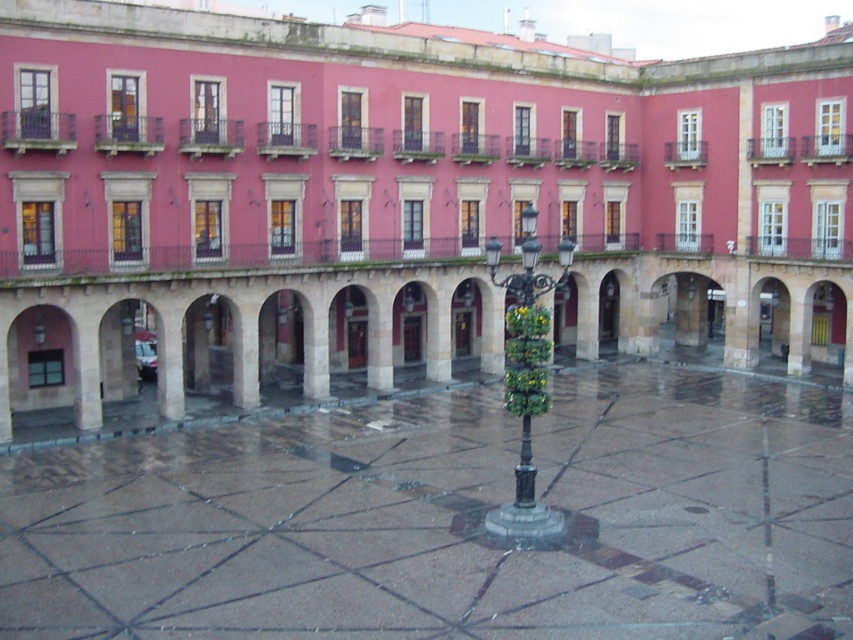
You are standing in the plaza and want to take a photo of the black metal streetlamp at center. To ensure the entire streetlamp is in frame, should you move closer to or further away from the polished stone courtyard at center?

The polished stone courtyard at center is in front of the black metal streetlamp at center. To ensure the entire streetlamp is in frame, you should move further away from the polished stone courtyard at center so that you can capture the streetlamp without obstruction.

You are a city planner reviewing the plaza design. The polished stone courtyard at center and the black metal streetlamp at center are both important elements. Which of these two elements takes up more space in the plaza layout?

The black metal streetlamp at center occupies more space than the polished stone courtyard at center according to the description.

You are standing in the plaza and want to take a photo of the black metal streetlamp at center. To avoid including the polished stone courtyard at center in your shot, should you move to the left or the right of the streetlamp?

The polished stone courtyard at center is to the left of the black metal streetlamp at center, so to avoid including it in your photo, you should move to the left side of the streetlamp.